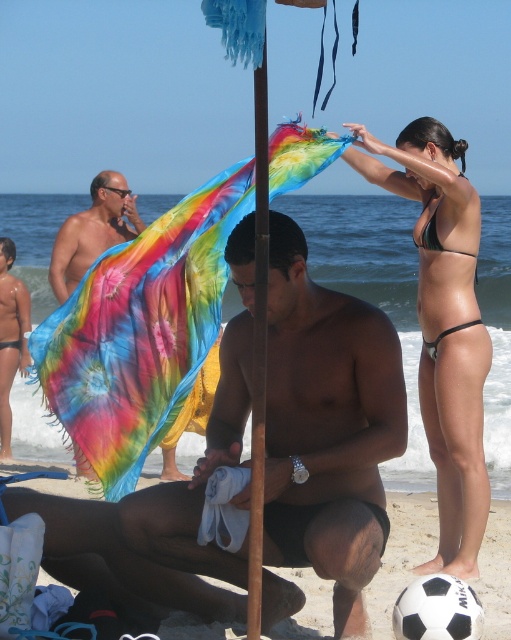
At what (x,y) coordinates should I click in order to perform the action: click on black matte soccer ball at lower center. Please return your answer as a coordinate pair (x, y). Looking at the image, I should click on (402, 554).

Does black matte soccer ball at lower center have a larger size compared to wooden pole at center?

No, black matte soccer ball at lower center is not bigger than wooden pole at center.

Between point (405, 529) and point (259, 464), which one is positioned in front?

Positioned in front is point (259, 464).

At what (x,y) coordinates should I click in order to perform the action: click on black matte soccer ball at lower center. Please return your answer as a coordinate pair (x, y). The height and width of the screenshot is (640, 511). Looking at the image, I should click on click(x=402, y=554).

Can you confirm if smooth tan skin at center is smaller than green and black bikini at upper right?

No.

Measure the distance from smooth tan skin at center to green and black bikini at upper right.

A distance of 4.73 feet exists between smooth tan skin at center and green and black bikini at upper right.

Who is more distant from viewer, (x=63, y=547) or (x=470, y=292)?

Positioned behind is point (x=470, y=292).

Image resolution: width=511 pixels, height=640 pixels. I want to click on smooth tan skin at center, so click(328, 428).

In the scene shown: Is black matte soccer ball at lower center below matte black skin at lower left?

Yes, black matte soccer ball at lower center is below matte black skin at lower left.

Is point (408, 518) positioned behind point (0, 244)?

No, (408, 518) is in front of (0, 244).

What do you see at coordinates (402, 554) in the screenshot? This screenshot has width=511, height=640. I see `black matte soccer ball at lower center` at bounding box center [402, 554].

The image size is (511, 640). What are the coordinates of `black matte soccer ball at lower center` in the screenshot? It's located at (402, 554).